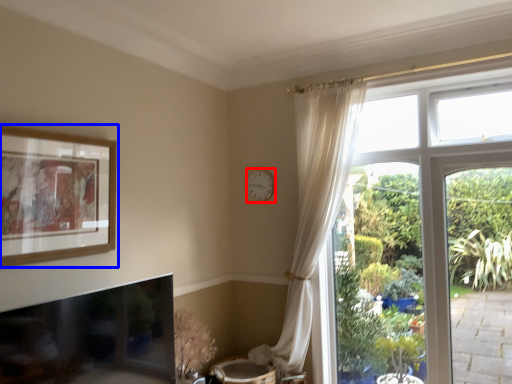
Question: Which object appears closest to the camera in this image, clock (highlighted by a red box) or picture frame (highlighted by a blue box)?

Choices:
 (A) clock
 (B) picture frame

Answer: (B)